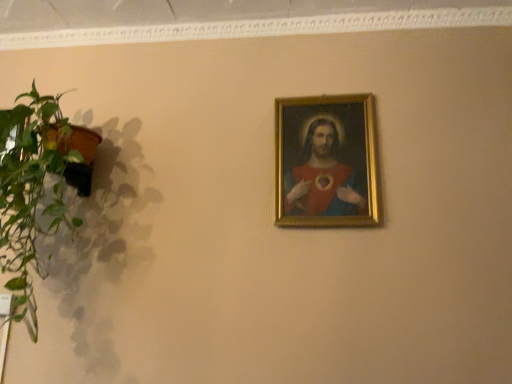
Question: Can you confirm if matte gold frame at upper center is shorter than green leafy plant at left?

Choices:
 (A) yes
 (B) no

Answer: (A)

Question: Does matte gold frame at upper center have a smaller size compared to green leafy plant at left?

Choices:
 (A) no
 (B) yes

Answer: (B)

Question: Does matte gold frame at upper center have a lesser width compared to green leafy plant at left?

Choices:
 (A) no
 (B) yes

Answer: (B)

Question: From the image's perspective, is matte gold frame at upper center under green leafy plant at left?

Choices:
 (A) no
 (B) yes

Answer: (A)

Question: Can you confirm if matte gold frame at upper center is taller than green leafy plant at left?

Choices:
 (A) yes
 (B) no

Answer: (B)

Question: Is matte gold frame at upper center located outside green leafy plant at left?

Choices:
 (A) yes
 (B) no

Answer: (A)

Question: Is the depth of green leafy plant at left less than that of matte gold frame at upper center?

Choices:
 (A) yes
 (B) no

Answer: (A)

Question: Would you say matte gold frame at upper center is part of green leafy plant at left's contents?

Choices:
 (A) yes
 (B) no

Answer: (B)

Question: From a real-world perspective, is green leafy plant at left beneath matte gold frame at upper center?

Choices:
 (A) yes
 (B) no

Answer: (A)

Question: From a real-world perspective, is green leafy plant at left on matte gold frame at upper center?

Choices:
 (A) yes
 (B) no

Answer: (B)

Question: Considering the relative sizes of green leafy plant at left and matte gold frame at upper center in the image provided, is green leafy plant at left wider than matte gold frame at upper center?

Choices:
 (A) no
 (B) yes

Answer: (B)

Question: Can you confirm if green leafy plant at left is thinner than matte gold frame at upper center?

Choices:
 (A) yes
 (B) no

Answer: (B)

Question: From the image's perspective, is matte gold frame at upper center above or below green leafy plant at left?

Choices:
 (A) above
 (B) below

Answer: (A)